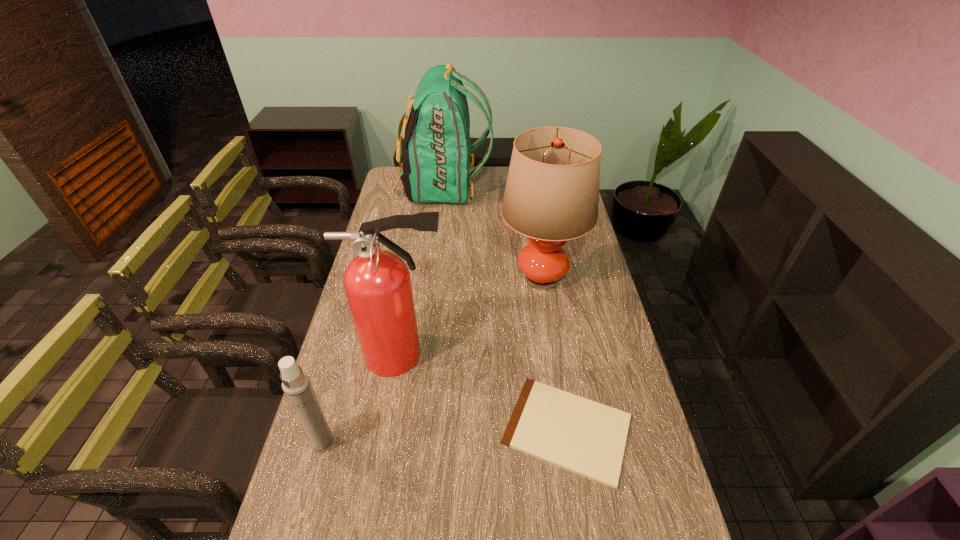
Identify the location of object at the far edge. (436, 160).

Where is `backpack that is at the left edge`? The height and width of the screenshot is (540, 960). backpack that is at the left edge is located at coordinates (436, 160).

Where is `fire extinguisher located in the left edge section of the desktop`? This screenshot has width=960, height=540. fire extinguisher located in the left edge section of the desktop is located at coordinates (377, 282).

Identify the location of aerosol can that is at the left edge. The width and height of the screenshot is (960, 540). (296, 385).

Locate an element on the screen. The image size is (960, 540). lamp located in the right edge section of the desktop is located at coordinates (552, 191).

I want to click on clipboard that is at the right edge, so click(583, 436).

You are a GUI agent. You are given a task and a screenshot of the screen. Output one action in this format:
    pyautogui.click(x=<x>, y=<y>)
    Task: Click on the object at the far left corner
    Image resolution: width=960 pixels, height=540 pixels.
    Given the screenshot: What is the action you would take?
    pyautogui.click(x=436, y=160)

Identify the location of free region at the left edge. (372, 412).

Find the location of a particular element. vacant area at the right edge of the desktop is located at coordinates (583, 260).

What are the coordinates of `vacant area that lies between the third nearest object and the shortest object` in the screenshot? It's located at (485, 392).